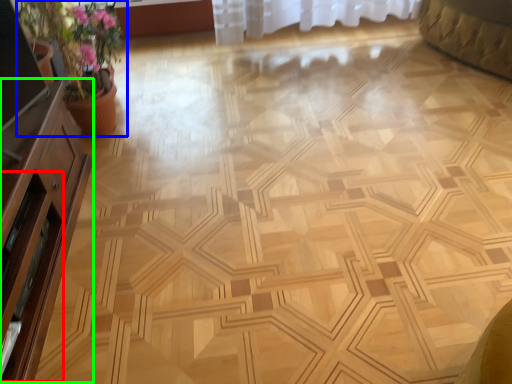
Question: Which object is the farthest from screen door (highlighted by a red box)? Choose among these: houseplant (highlighted by a blue box) or dresser (highlighted by a green box).

Choices:
 (A) houseplant
 (B) dresser

Answer: (A)